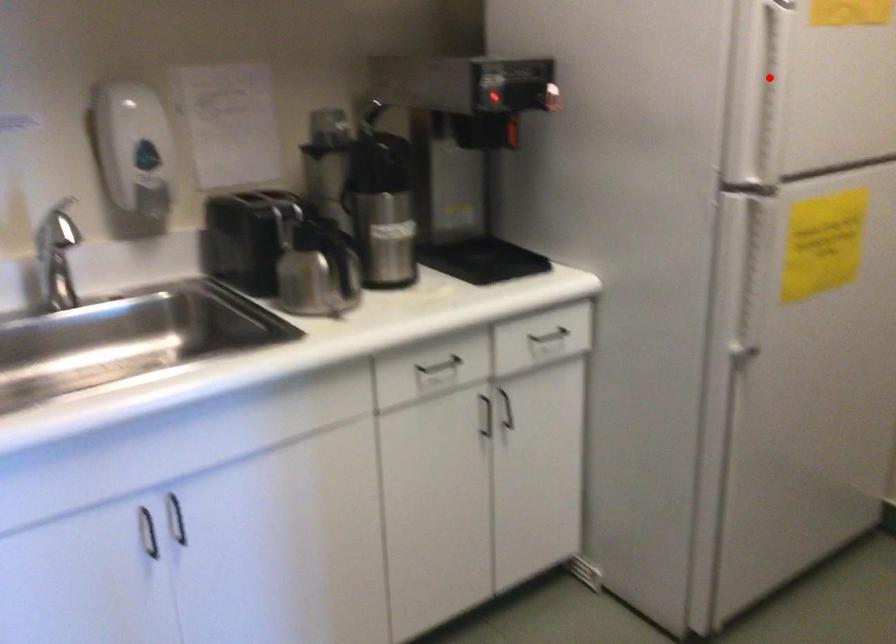
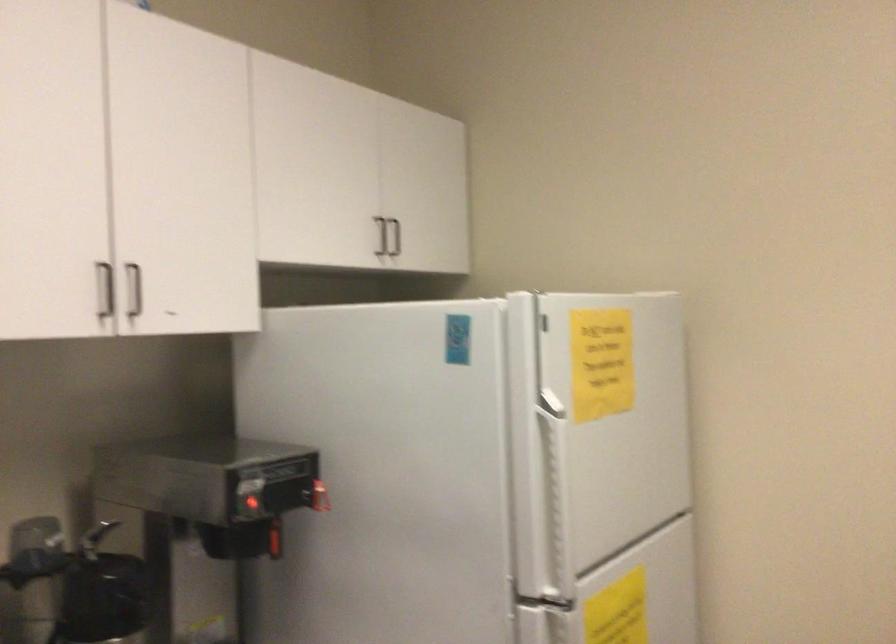
The point at the highlighted location is marked in the first image. Where is the corresponding point in the second image?

(554, 486)